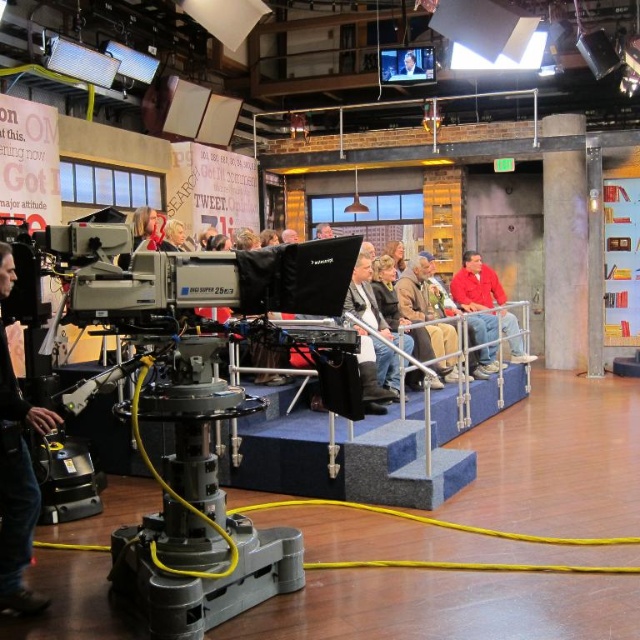
Identify the location of red matte jacket at right. (486, 301).

In order to click on red matte jacket at right in this screenshot , I will do `click(486, 301)`.

Between blonde hair at center and smooth skin face at upper center, which one is positioned higher?

smooth skin face at upper center is higher up.

Is blonde hair at center smaller than smooth skin face at upper center?

Actually, blonde hair at center might be larger than smooth skin face at upper center.

Identify the location of blonde hair at center. Image resolution: width=640 pixels, height=640 pixels. (145, 227).

Is red matte jacket at right wider than blonde hair at center?

Correct, the width of red matte jacket at right exceeds that of blonde hair at center.

Based on the photo, who is shorter, red matte jacket at right or blonde hair at center?

With less height is blonde hair at center.

Is point (483, 320) farther from camera compared to point (138, 211)?

That is True.

Find the location of a particular element. This screenshot has height=640, width=640. red matte jacket at right is located at coordinates (486, 301).